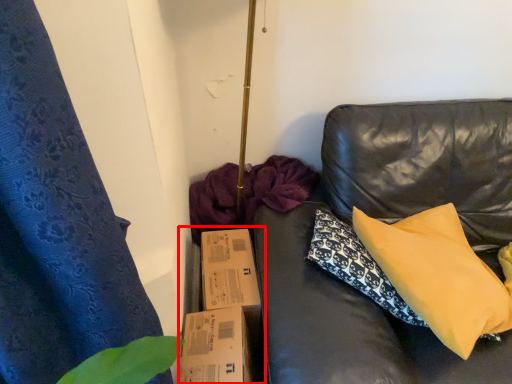
Question: From the image's perspective, where is cardboard box (annotated by the red box) located relative to pillow?

Choices:
 (A) below
 (B) above

Answer: (A)